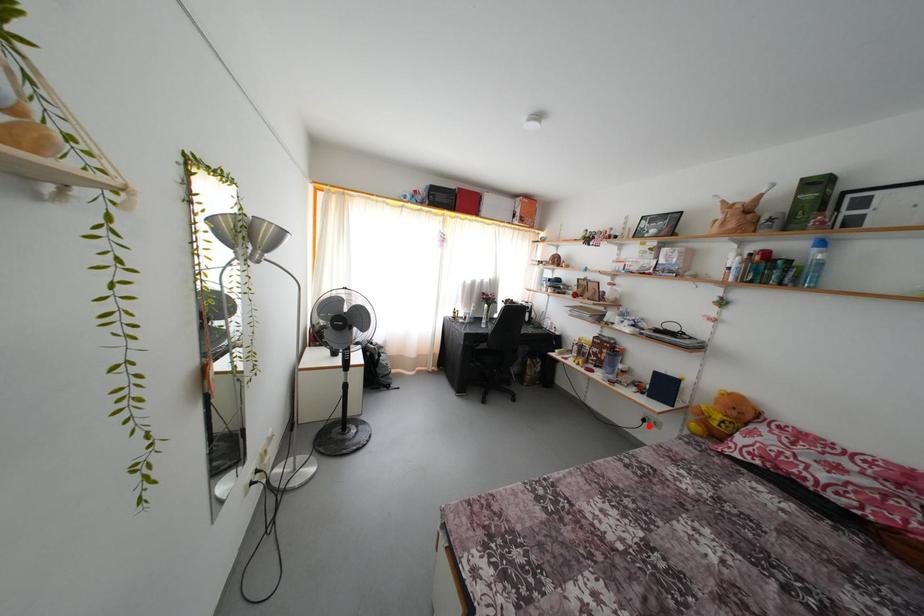
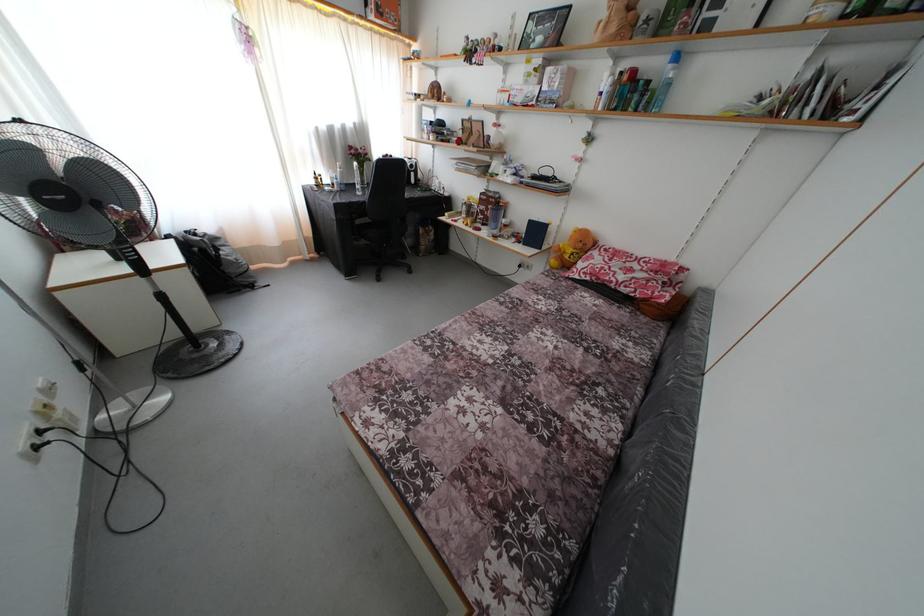
Question: I am providing you with two images of the same scene from different viewpoints. In image1, a red point is highlighted. Considering the same 3D point in image2, which of the following is correct?

Choices:
 (A) It is closer
 (B) It is farther

Answer: (A)